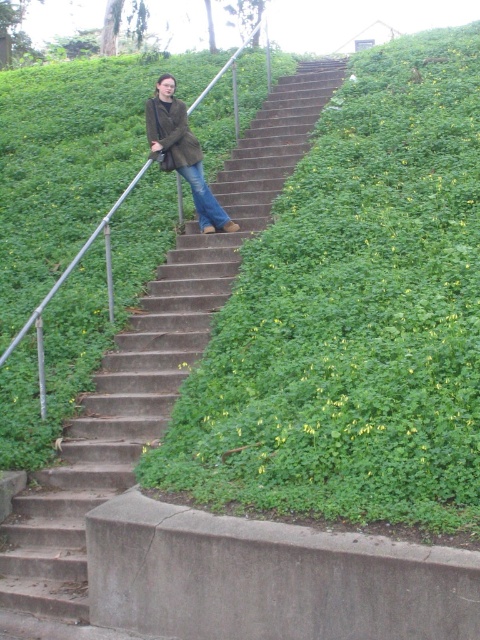
You are an observer looking at the person on the stairs. Which item is positioned to the right of the other between the matte brown coat at center and the matte brown jacket at upper center?

The matte brown coat at center is positioned to the right of the matte brown jacket at upper center.

You are a photographer trying to capture the matte brown coat at center while standing on the concrete stairs at center. Can you take a photo of the coat without moving from your current position?

The concrete stairs at center is in front of matte brown coat at center, so you cannot take a photo of the coat without moving from your current position because the stairs are blocking the view.